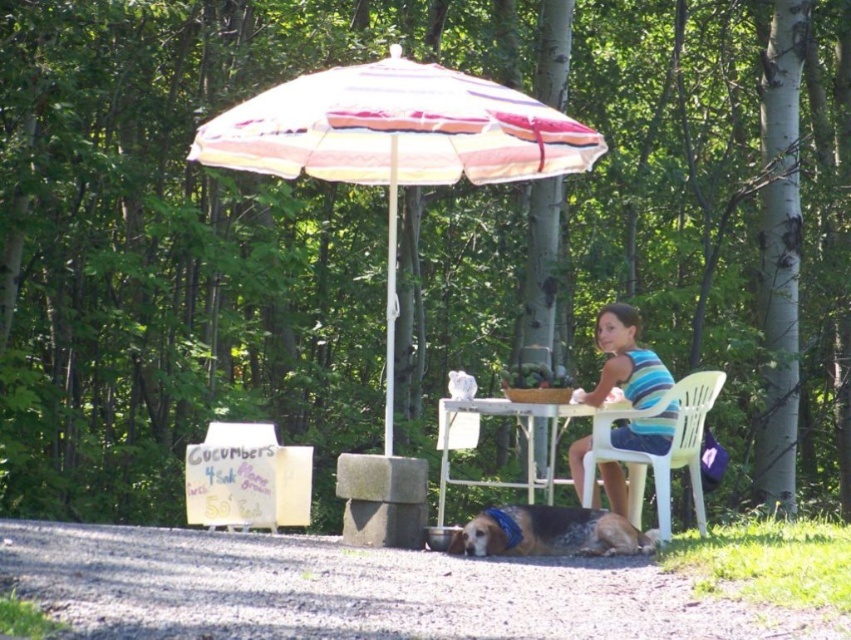
Question: Which of the following is the closest to the observer?

Choices:
 (A) (387, 454)
 (B) (700, 387)
 (C) (643, 372)

Answer: (A)

Question: Observing the image, what is the correct spatial positioning of striped fabric shirt at center in reference to white plastic chair at center?

Choices:
 (A) left
 (B) right

Answer: (A)

Question: Which of the following is the closest to the observer?

Choices:
 (A) white plastic table at center
 (B) brown speckled fur dog at lower center
 (C) white plastic chair at center

Answer: (B)

Question: Does striped fabric umbrella at center appear over striped fabric shirt at center?

Choices:
 (A) yes
 (B) no

Answer: (A)

Question: Which object appears farthest from the camera in this image?

Choices:
 (A) white plastic table at center
 (B) striped fabric shirt at center
 (C) white plastic chair at center

Answer: (A)

Question: Is striped fabric umbrella at center to the left of white plastic table at center from the viewer's perspective?

Choices:
 (A) yes
 (B) no

Answer: (A)